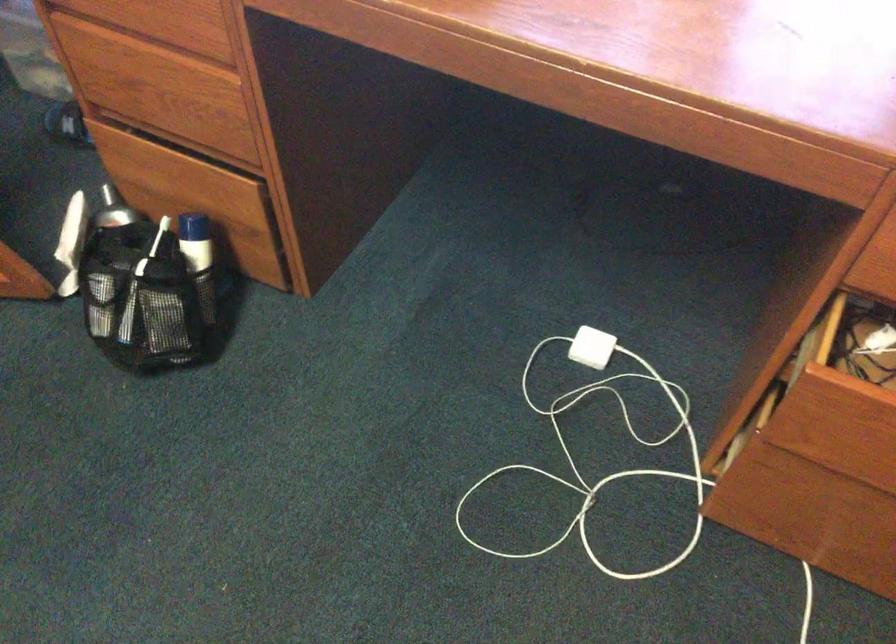
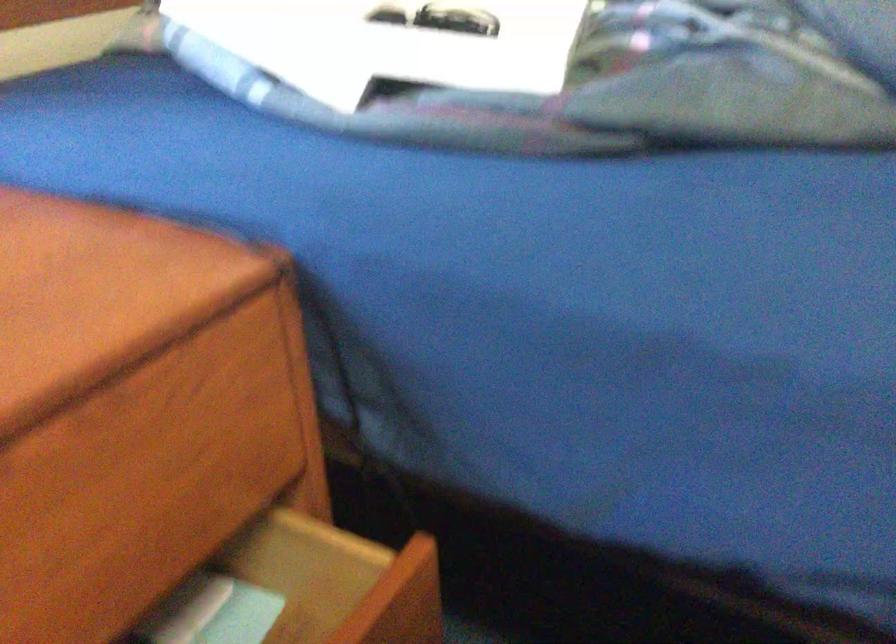
Question: The images are taken continuously from a first-person perspective. In which direction is your viewpoint rotating?

Choices:
 (A) Left
 (B) Right
 (C) Up
 (D) Down

Answer: (B)